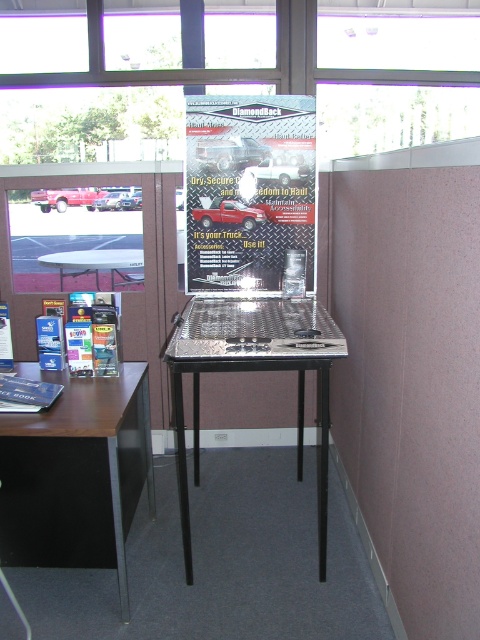
Consider the image. Which of these two, brown wood desk at lower left or metallic/diamond plate table at center, stands taller?

metallic/diamond plate table at center is taller.

Is brown wood desk at lower left positioned before metallic/diamond plate table at center?

Yes, brown wood desk at lower left is closer to the viewer.

Is point (96, 388) in front of point (189, 352)?

No, (96, 388) is behind (189, 352).

Identify the location of brown wood desk at lower left. (76, 474).

Who is lower down, brown wood desk at lower left or transparent glass table at center?

brown wood desk at lower left

Is point (132, 476) behind point (62, 280)?

No, (132, 476) is in front of (62, 280).

Which is in front, point (110, 545) or point (100, 264)?

Point (110, 545)

In order to click on brown wood desk at lower left in this screenshot , I will do `click(76, 474)`.

Is point (24, 544) less distant than point (81, 250)?

That is True.

This screenshot has width=480, height=640. Identify the location of brown wood desk at lower left. (76, 474).

Where is `brown wood desk at lower left`? Image resolution: width=480 pixels, height=640 pixels. brown wood desk at lower left is located at coordinates (76, 474).